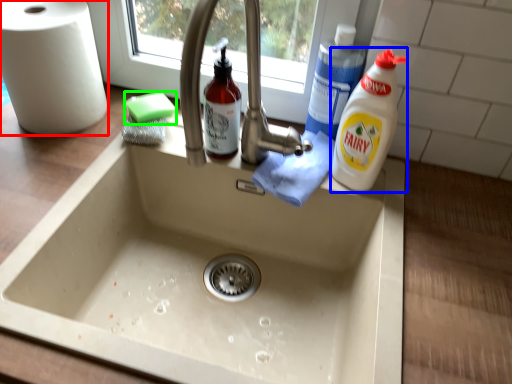
Question: Estimate the real-world distances between objects in this image. Which object is closer to paper towel (highlighted by a red box), cleaning product (highlighted by a blue box) or soap (highlighted by a green box)?

Choices:
 (A) cleaning product
 (B) soap

Answer: (B)